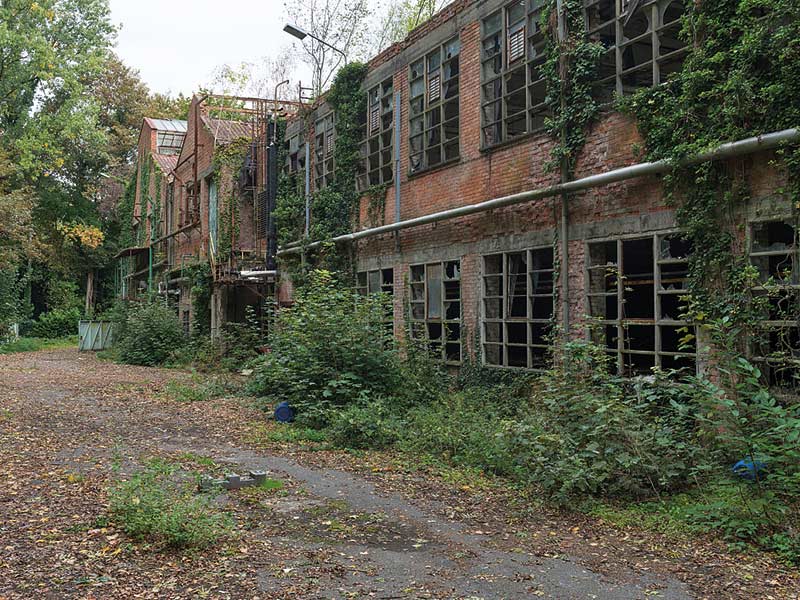
Identify the location of ventilation. This screenshot has width=800, height=600. (430, 84), (517, 42), (374, 119), (330, 140).